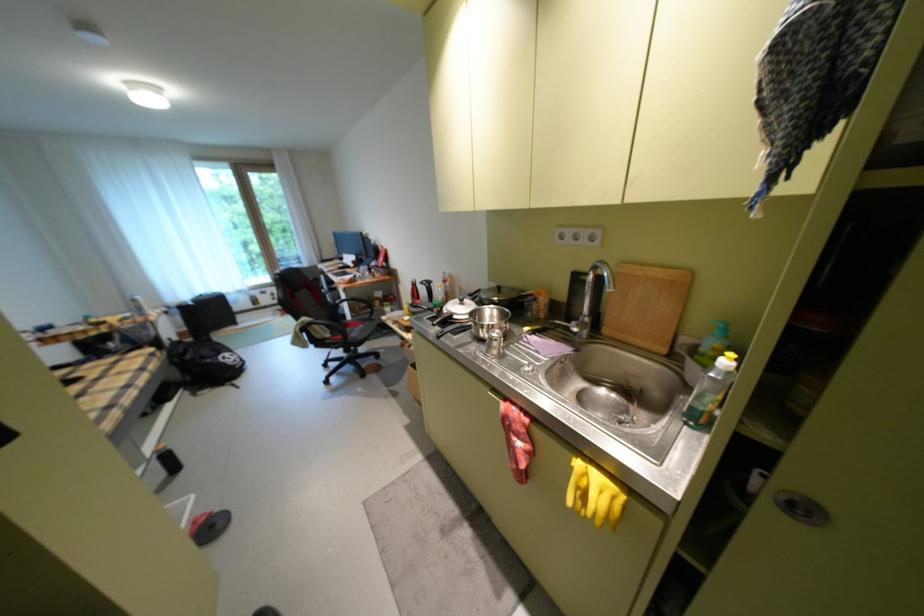
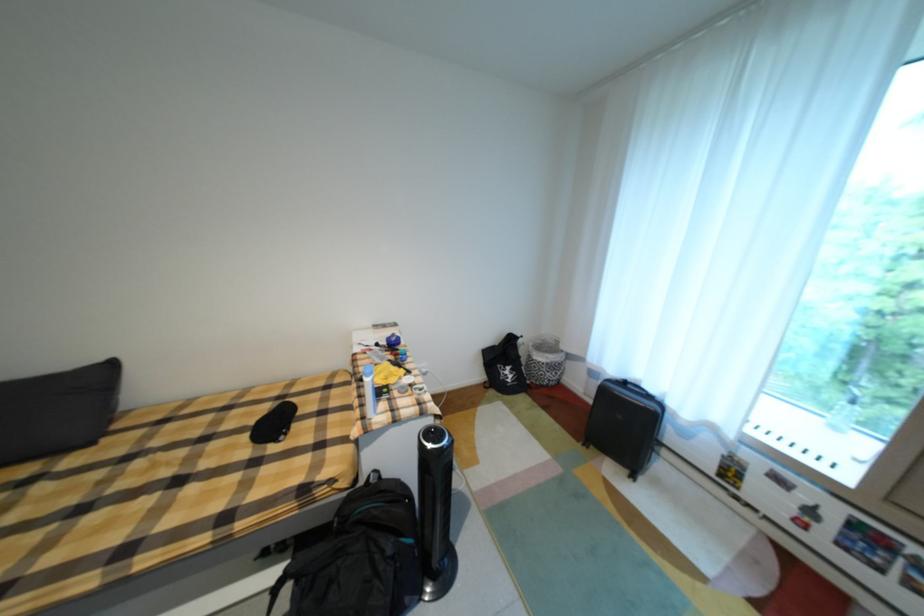
Locate, in the second image, the point that corresponds to [212,296] in the first image.

(635, 384)